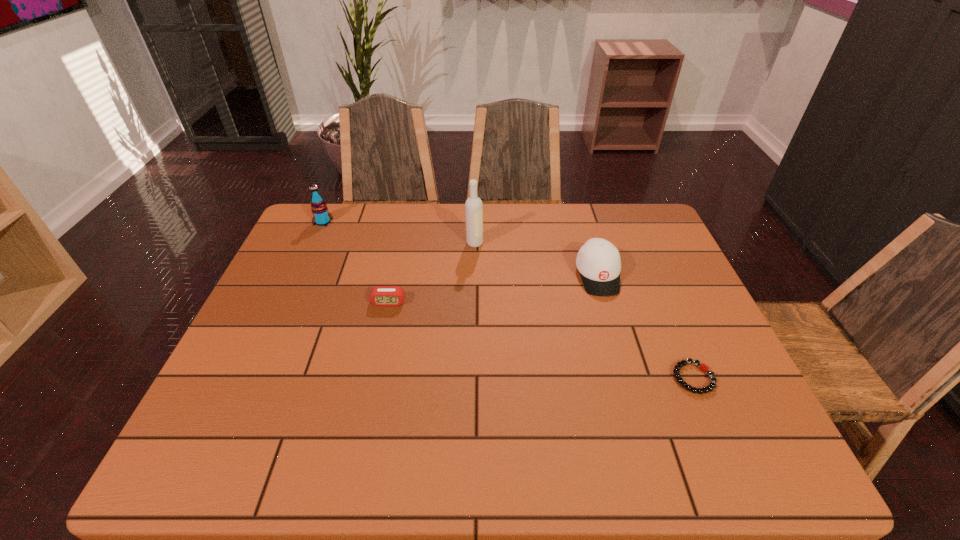
The width and height of the screenshot is (960, 540). Find the location of `unoccupied position between the rightmost object and the second tallest object`. unoccupied position between the rightmost object and the second tallest object is located at coordinates (508, 300).

You are a GUI agent. You are given a task and a screenshot of the screen. Output one action in this format:
    pyautogui.click(x=<x>, y=<y>)
    Task: Click on the free space between the vodka and the rightmost object
    This screenshot has width=960, height=540.
    Given the screenshot: What is the action you would take?
    pyautogui.click(x=584, y=310)

I want to click on vacant area that lies between the baseball cap and the nearest object, so click(x=645, y=327).

This screenshot has height=540, width=960. What are the coordinates of `vacant area that lies between the second shortest object and the bracelet` in the screenshot? It's located at (540, 340).

Where is `free space between the second shortest object and the farthest object`? free space between the second shortest object and the farthest object is located at coordinates (356, 262).

Locate an element on the screen. object that stands as the closest to the second shortest object is located at coordinates (473, 206).

Identify which object is located as the third nearest to the bracelet. Please provide its 2D coordinates. Your answer should be formatted as a tuple, i.e. [(x, y)], where the tuple contains the x and y coordinates of a point satisfying the conditions above.

[(380, 295)]

Identify the location of free location that satisfies the following two spatial constraints: 1. on the front-facing side of the second object from left to right; 2. on the right side of the shortest object. Image resolution: width=960 pixels, height=540 pixels. (372, 377).

Identify the location of vacant space that satisfies the following two spatial constraints: 1. on the front-facing side of the alarm clock; 2. on the right side of the nearest object. (372, 377).

You are a GUI agent. You are given a task and a screenshot of the screen. Output one action in this format:
    pyautogui.click(x=<x>, y=<y>)
    Task: Click on the free point that satisfies the following two spatial constraints: 1. on the front-facing side of the third tallest object; 2. on the left side of the rightmost object
    Image resolution: width=960 pixels, height=540 pixels.
    Given the screenshot: What is the action you would take?
    pyautogui.click(x=628, y=377)